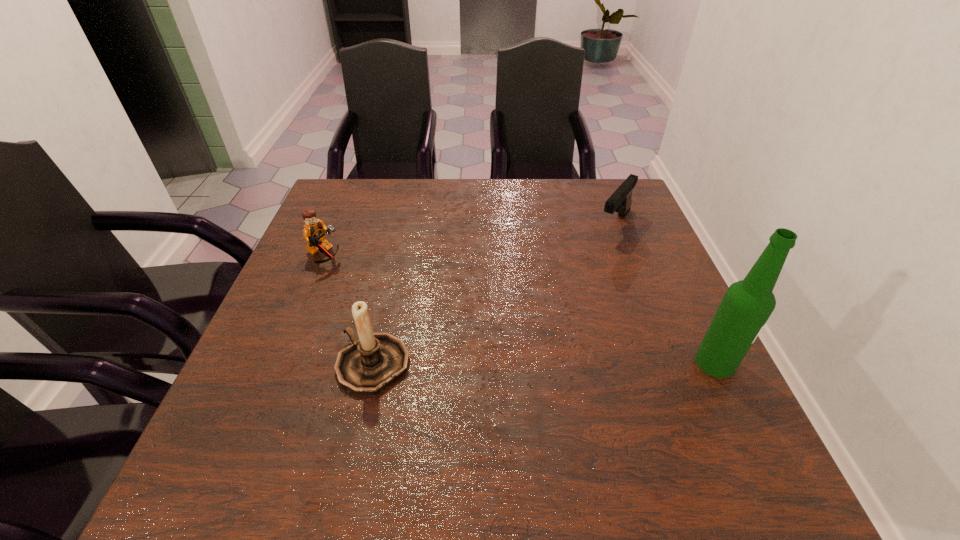
What are the coordinates of `the third shortest object` in the screenshot? It's located at (375, 360).

You are a GUI agent. You are given a task and a screenshot of the screen. Output one action in this format:
    pyautogui.click(x=<x>, y=<y>)
    Task: Click on the third object from right to left
    This screenshot has width=960, height=540.
    Given the screenshot: What is the action you would take?
    pyautogui.click(x=375, y=360)

Find the location of a particular element. the tallest object is located at coordinates (747, 304).

Where is `pistol`? pistol is located at coordinates (620, 201).

Locate an element on the screen. This screenshot has width=960, height=540. Lego is located at coordinates (314, 231).

At what (x,y) coordinates should I click in order to perform the action: click on vacant area located on the right of the candle holder. Please return your answer as a coordinate pair (x, y). Image resolution: width=960 pixels, height=540 pixels. Looking at the image, I should click on (469, 364).

The height and width of the screenshot is (540, 960). I want to click on vacant area located on the front-facing side of the pistol, so click(x=564, y=293).

Locate an element on the screen. The height and width of the screenshot is (540, 960). vacant area located on the front-facing side of the pistol is located at coordinates (590, 260).

Locate an element on the screen. Image resolution: width=960 pixels, height=540 pixels. free location located on the front-facing side of the pistol is located at coordinates [x=560, y=299].

This screenshot has width=960, height=540. In order to click on vacant area situated 0.090m holding a crossbow in the hands of the leftmost object in this screenshot , I will do `click(366, 278)`.